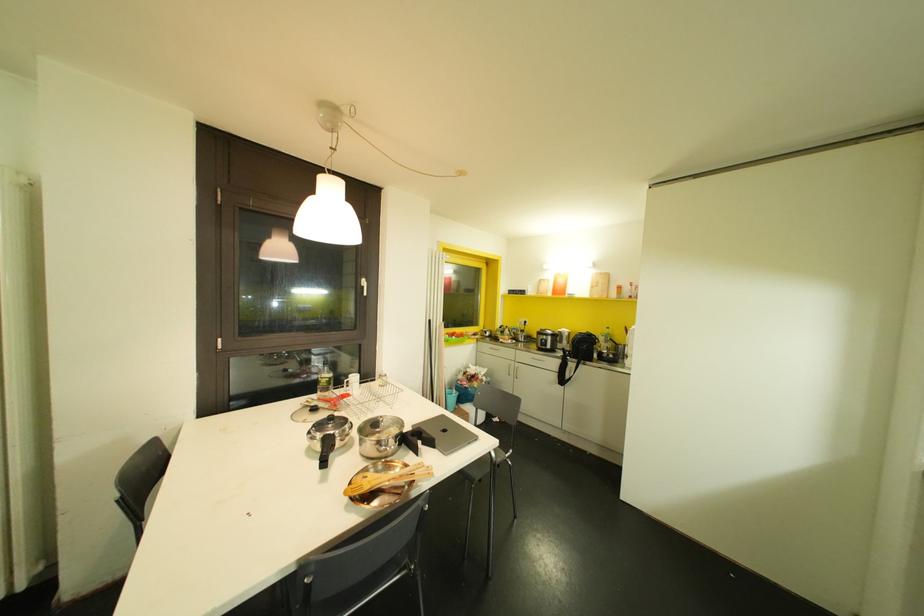
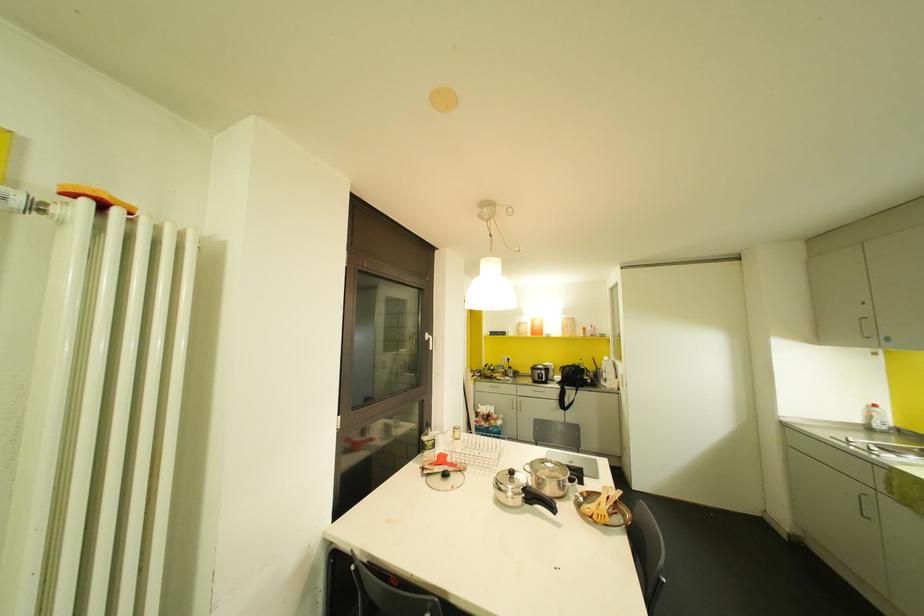
In the second image, find the point that corresponds to the point at 363,294 in the first image.

(430, 347)